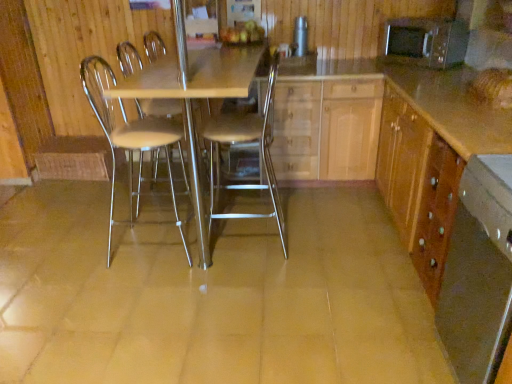
You are a GUI agent. You are given a task and a screenshot of the screen. Output one action in this format:
    pyautogui.click(x=<x>, y=<y>)
    Task: Click on the free space in front of metallic silver chair at center, which is counted as the first chair, starting from the right
    The width and height of the screenshot is (512, 384).
    Given the screenshot: What is the action you would take?
    pyautogui.click(x=250, y=283)